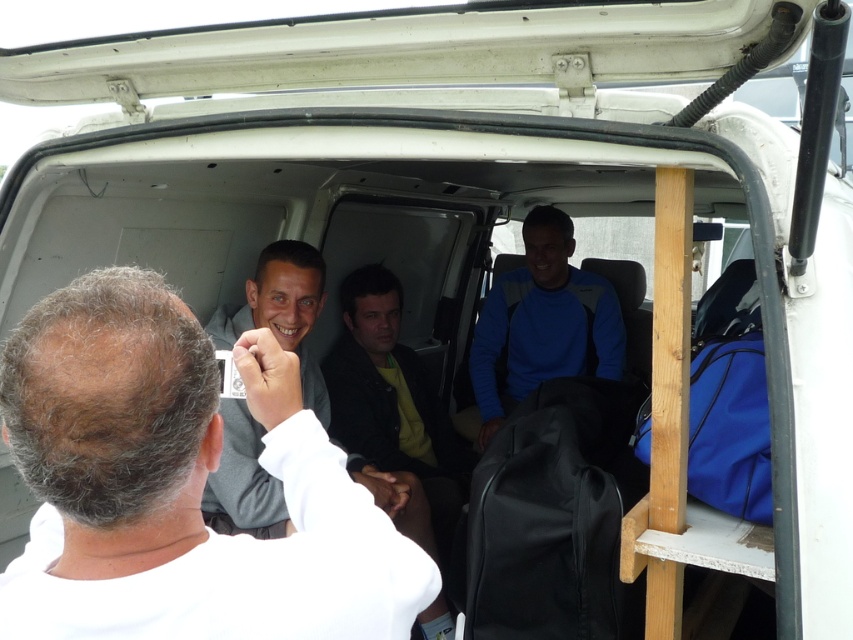
Question: Can you confirm if white matte shirt at center is smaller than gray matte jacket at center?

Choices:
 (A) no
 (B) yes

Answer: (B)

Question: Estimate the real-world distances between objects in this image. Which object is closer to the gray matte jacket at center?

Choices:
 (A) blue fleece jacket at center
 (B) white matte shirt at center

Answer: (A)

Question: Among these objects, which one is nearest to the camera?

Choices:
 (A) blue fleece jacket at center
 (B) white matte shirt at center

Answer: (B)

Question: Is blue fleece jacket at center wider than gray matte jacket at center?

Choices:
 (A) yes
 (B) no

Answer: (A)

Question: Can you confirm if white matte shirt at center is positioned to the left of gray matte jacket at center?

Choices:
 (A) no
 (B) yes

Answer: (A)

Question: Which of the following is the closest to the observer?

Choices:
 (A) (292, 541)
 (B) (556, 300)

Answer: (A)